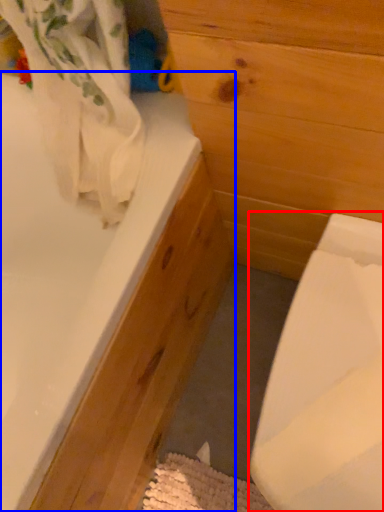
Question: Which point is further to the camera, sink (highlighted by a red box) or bathtub (highlighted by a blue box)?

Choices:
 (A) sink
 (B) bathtub

Answer: (A)